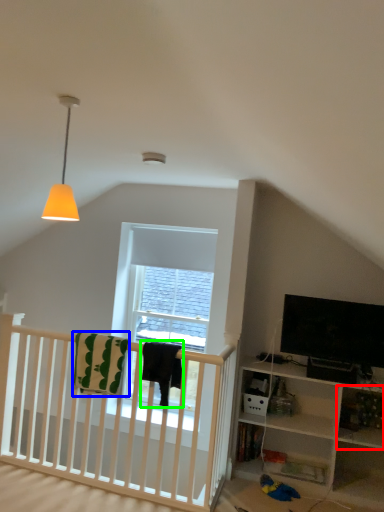
Question: Based on their relative distances, which object is farther from shelf (highlighted by a red box)? Choose from blanket (highlighted by a blue box) and blanket (highlighted by a green box).

Choices:
 (A) blanket
 (B) blanket

Answer: (A)